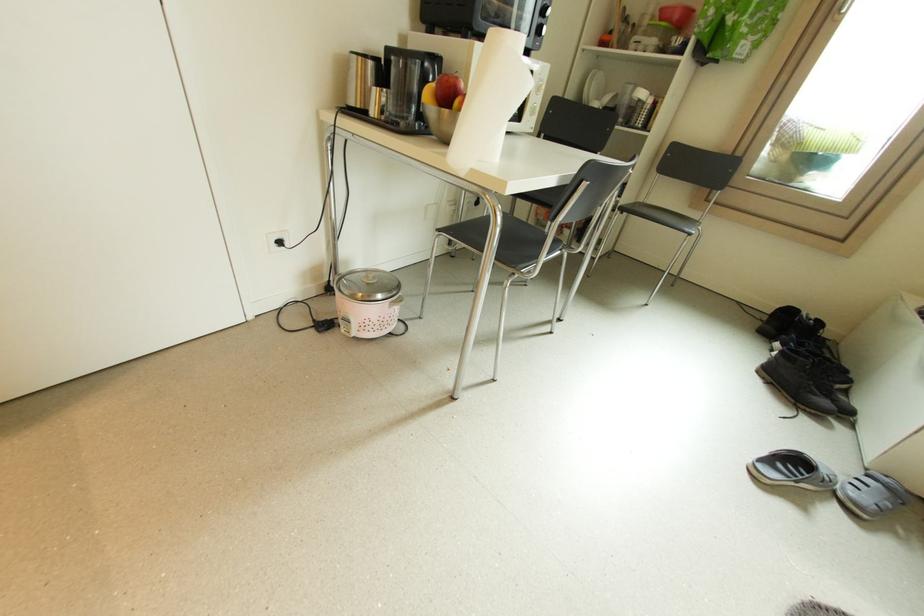
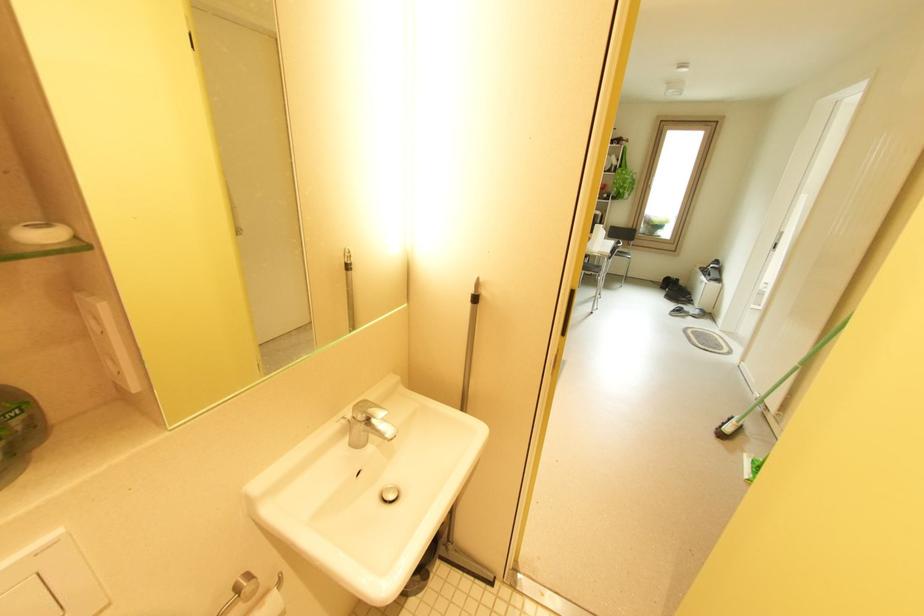
The images are taken continuously from a first-person perspective. In which direction are you moving?

The cameraman walked toward left, backward.